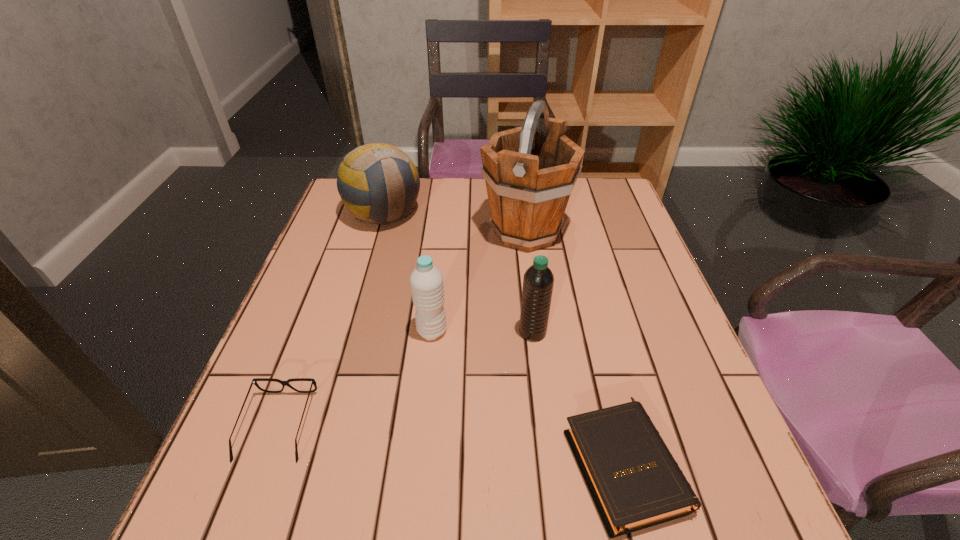
You are a GUI agent. You are given a task and a screenshot of the screen. Output one action in this format:
    pyautogui.click(x=<x>, y=<y>)
    Task: Click on the vacant space at the near edge
    
    Given the screenshot: What is the action you would take?
    pyautogui.click(x=496, y=500)

Where is `vacant region at the left edge`? This screenshot has width=960, height=540. vacant region at the left edge is located at coordinates (296, 327).

Locate an element on the screen. free space at the right edge is located at coordinates (698, 402).

Where is `vacant region at the far right corner`? This screenshot has height=540, width=960. vacant region at the far right corner is located at coordinates (603, 191).

You are a GUI agent. You are given a task and a screenshot of the screen. Output one action in this format:
    pyautogui.click(x=<x>, y=<y>)
    Task: Click on the empty space that is in between the spectacles and the volleyball
    This screenshot has width=960, height=540.
    Given the screenshot: What is the action you would take?
    pyautogui.click(x=331, y=319)

The image size is (960, 540). I want to click on free space between the bucket and the third object from left to right, so click(479, 281).

This screenshot has width=960, height=540. What are the coordinates of `free spot between the left water bottle and the spectacles` in the screenshot? It's located at (355, 378).

Where is `blank region between the Bible and the volleyball`? Image resolution: width=960 pixels, height=540 pixels. blank region between the Bible and the volleyball is located at coordinates (504, 339).

Image resolution: width=960 pixels, height=540 pixels. What are the coordinates of `free spot between the volleyball and the Bible` in the screenshot? It's located at (504, 339).

The image size is (960, 540). Find the location of `vacant space that is in between the tallest object and the Bible`. vacant space that is in between the tallest object and the Bible is located at coordinates coord(575,348).